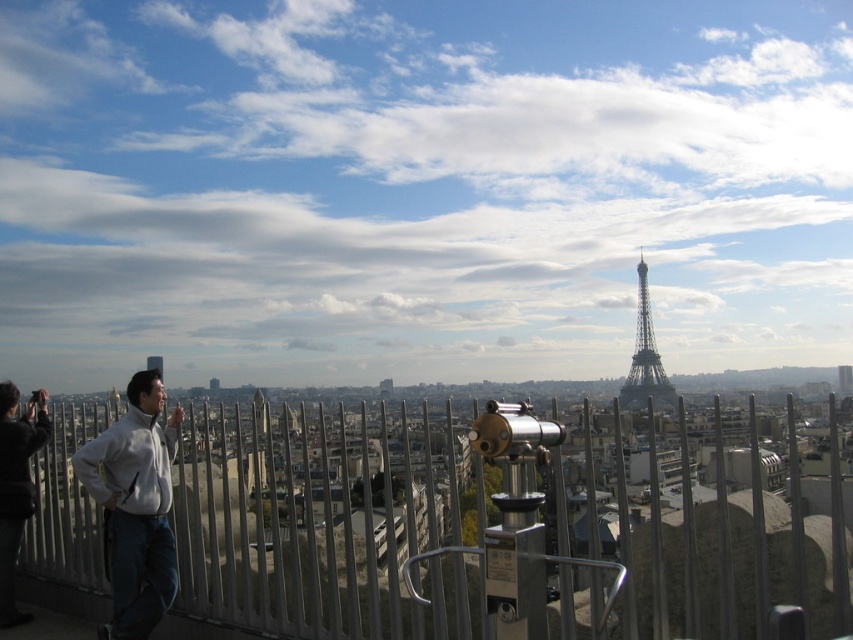
Is metallic silver fence at center to the right of white fleece jacket at lower left from the viewer's perspective?

Indeed, metallic silver fence at center is positioned on the right side of white fleece jacket at lower left.

Does metallic silver fence at center have a lesser width compared to white fleece jacket at lower left?

Incorrect, metallic silver fence at center's width is not less than white fleece jacket at lower left's.

Where is `metallic silver fence at center`? The image size is (853, 640). metallic silver fence at center is located at coordinates (460, 538).

Can you confirm if metallic silver fence at center is bigger than shiny metallic eiffel tower at center?

Correct, metallic silver fence at center is larger in size than shiny metallic eiffel tower at center.

Identify the location of metallic silver fence at center. (460, 538).

At what (x,y) coordinates should I click in order to perform the action: click on metallic silver fence at center. Please return your answer as a coordinate pair (x, y). Looking at the image, I should click on (460, 538).

Which is above, white fleece jacket at lower left or shiny metallic eiffel tower at center?

shiny metallic eiffel tower at center is above.

What do you see at coordinates (135, 506) in the screenshot? The height and width of the screenshot is (640, 853). I see `white fleece jacket at lower left` at bounding box center [135, 506].

The height and width of the screenshot is (640, 853). In order to click on white fleece jacket at lower left in this screenshot , I will do `click(135, 506)`.